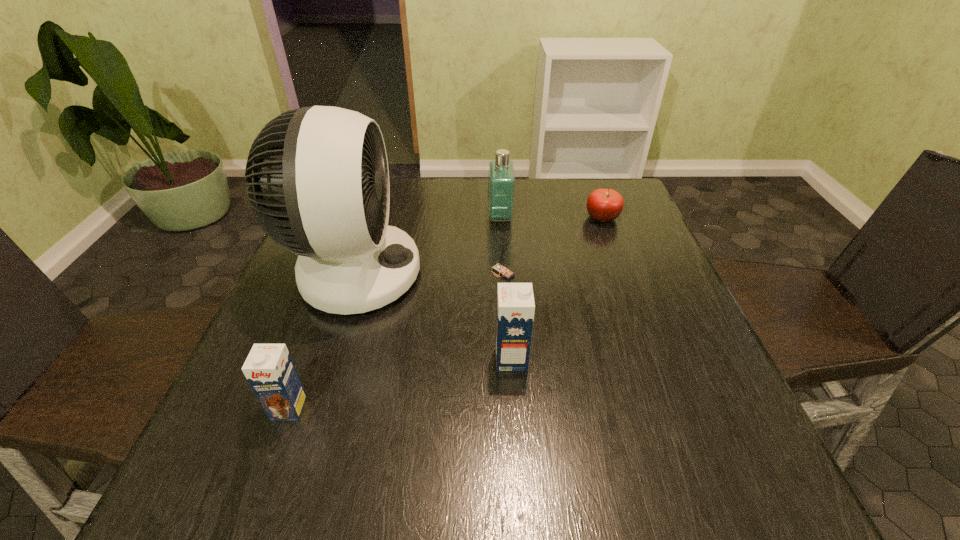
This screenshot has width=960, height=540. In order to click on free spot that satisfies the following two spatial constraints: 1. on the front label of the rightmost object; 2. on the left side of the perfume in this screenshot , I will do `click(500, 218)`.

The height and width of the screenshot is (540, 960). Identify the location of vacant space that satisfies the following two spatial constraints: 1. on the front label of the perfume; 2. on the back side of the apple. (500, 218).

The height and width of the screenshot is (540, 960). Identify the location of vacant space that satisfies the following two spatial constraints: 1. on the front label of the perfume; 2. on the left side of the rightmost object. (500, 218).